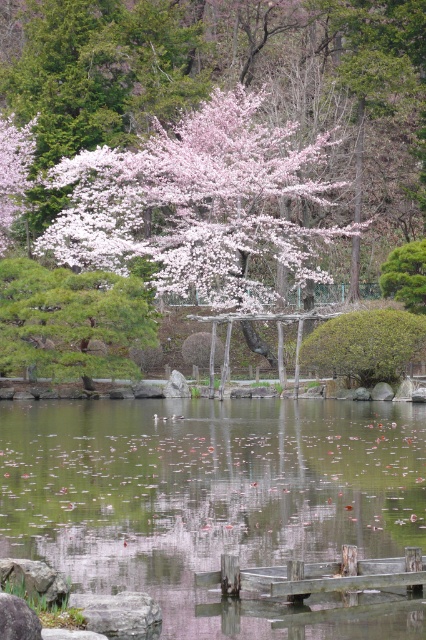
You are a photographer standing in the garden and want to capture the transparent water at center and pink blossoms at center in a single shot. Which object will appear larger in the photo?

The transparent water at center will appear larger in the photo because it is closer to the viewer than the pink blossoms at center.

You are a visitor in the Japanese garden and want to take a photo of the transparent water at center and pink blossoms at center. Which object should you focus on first if you want to capture both in one frame?

You should focus on the pink blossoms at center first because the transparent water at center is positioned on the right side of pink blossoms at center, so adjusting the frame to include both would require starting with the leftmost object.

You are standing in a traditional Japanese garden and want to know how far the point at coordinates (109, 285) is from your current position. Can you determine the distance?

The distance between the point at coordinates (109, 285) and the viewer is 49.11 meters.